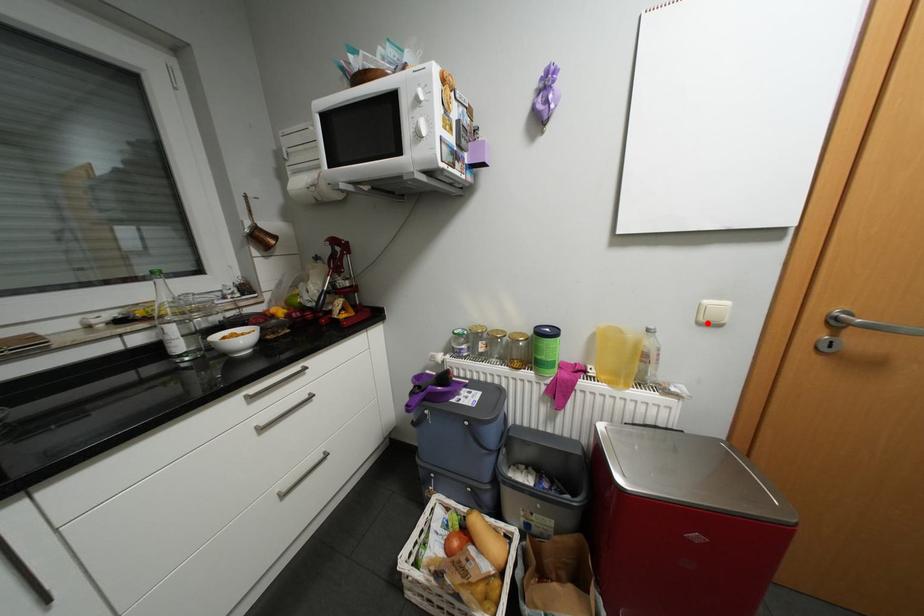
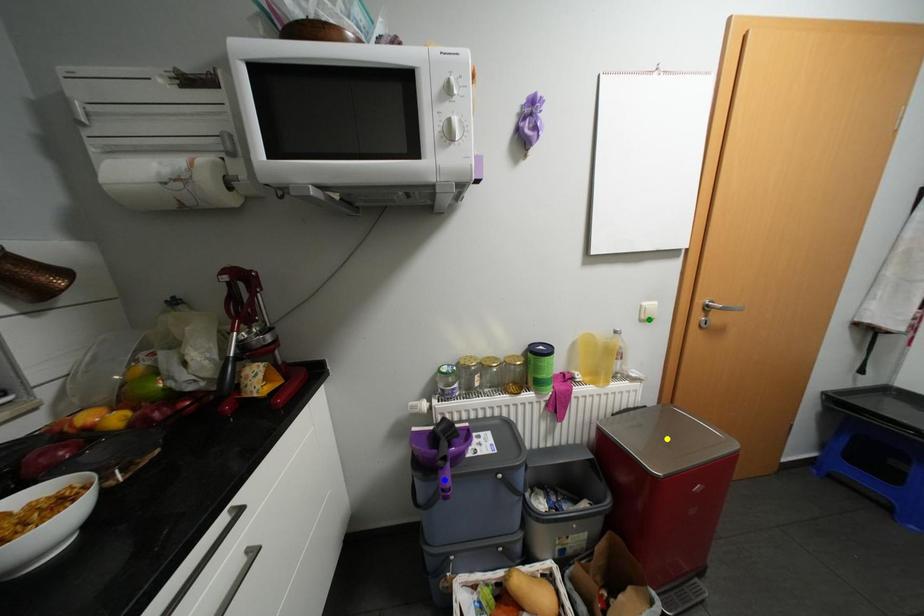
Question: I am providing you with two images of the same scene from different viewpoints. A red point is marked on the first image. You are given multiple points on the second image. Which mark in image 2 goes with the point in image 1?

Choices:
 (A) green point
 (B) yellow point
 (C) blue point

Answer: (A)